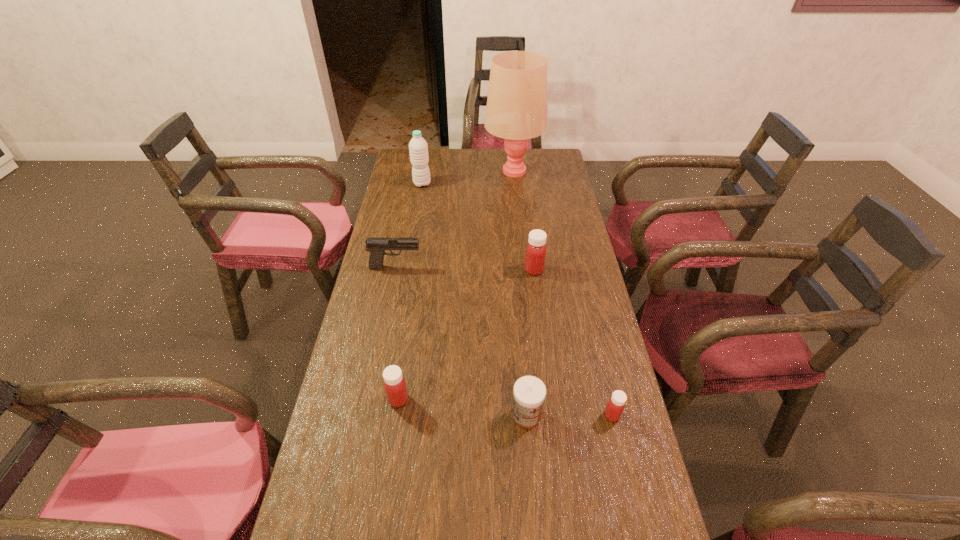
Find the location of a particular element. Image resolution: width=960 pixels, height=540 pixels. pink lampshade is located at coordinates (516, 110).

This screenshot has height=540, width=960. In order to click on the tallest object in this screenshot , I will do `click(516, 110)`.

I want to click on white water bottle, so click(418, 148).

Find the location of a particular element. Image resolution: width=960 pixels, height=540 pixels. the sixth shortest object is located at coordinates (418, 148).

Where is `the tallest medicine`? Image resolution: width=960 pixels, height=540 pixels. the tallest medicine is located at coordinates (535, 255).

What are the coordinates of `the farthest red medicine` in the screenshot? It's located at (535, 255).

Locate an element on the screen. This screenshot has width=960, height=540. pistol is located at coordinates (376, 246).

I want to click on the leftmost red medicine, so click(x=395, y=387).

I want to click on the second biggest red medicine, so click(395, 387).

This screenshot has width=960, height=540. Find the location of `white medicine`. white medicine is located at coordinates (529, 393).